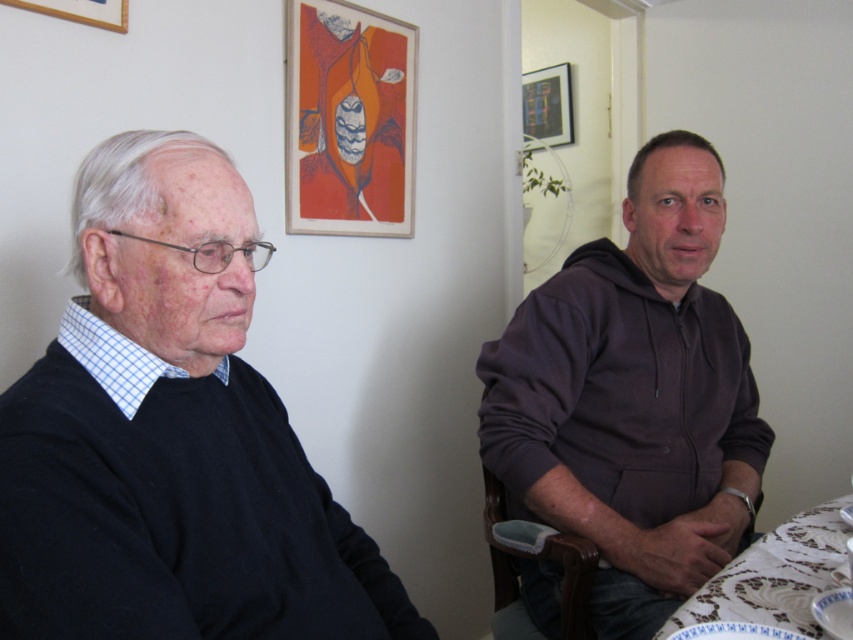
Question: Can you confirm if black matte sweater at left is thinner than wooden picture frame at upper left?

Choices:
 (A) no
 (B) yes

Answer: (A)

Question: Among these points, which one is farthest from the camera?

Choices:
 (A) (289, 65)
 (B) (219, 372)

Answer: (A)

Question: Is black matte sweater at left smaller than dark gray hoodie at right?

Choices:
 (A) yes
 (B) no

Answer: (A)

Question: Is black matte sweater at left to the right of wooden picture frame at upper center from the viewer's perspective?

Choices:
 (A) yes
 (B) no

Answer: (B)

Question: Which point is farther from the camera taking this photo?

Choices:
 (A) (293, 515)
 (B) (730, 609)

Answer: (B)

Question: Which point appears closest to the camera in this image?

Choices:
 (A) (567, 124)
 (B) (822, 560)
 (C) (689, 374)

Answer: (B)